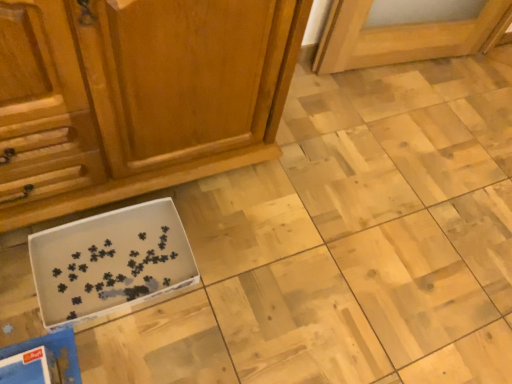
I want to click on empty space that is to the right of wooden cabinet at lower left, so click(314, 209).